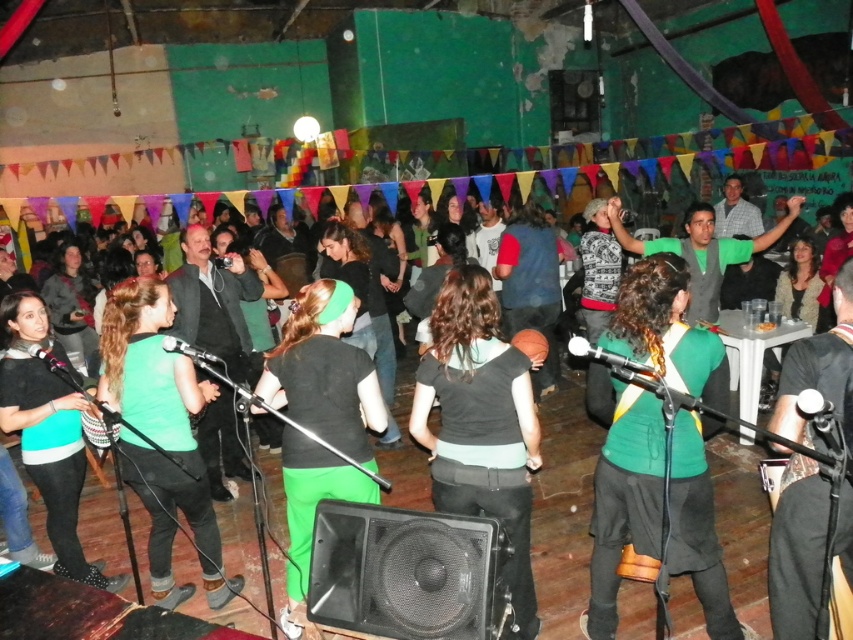
Question: Which object is positioned farthest from the green matte shirt at center?

Choices:
 (A) green matte/black t-shirt at center
 (B) green fabric shirt at center

Answer: (B)

Question: Can you confirm if green fabric shirt at center is positioned to the right of black matte shirt at center?

Choices:
 (A) no
 (B) yes

Answer: (B)

Question: Can you confirm if green fabric shirt at center is bigger than green matte/black t-shirt at center?

Choices:
 (A) yes
 (B) no

Answer: (A)

Question: Estimate the real-world distances between objects in this image. Which object is closer to the green fabric shirt at center?

Choices:
 (A) green matte shirt at center
 (B) black matte shirt at center

Answer: (A)

Question: Which point is farther to the camera?

Choices:
 (A) (296, 372)
 (B) (715, 352)

Answer: (A)

Question: Can you confirm if green matte shirt at center is positioned above black matte shirt at center?

Choices:
 (A) no
 (B) yes

Answer: (A)